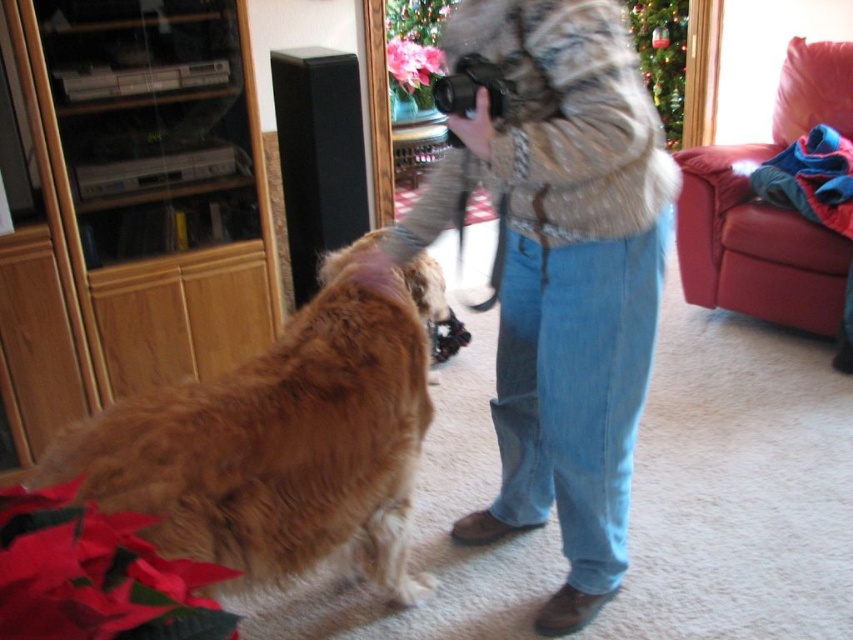
Question: Is golden fur dog at center to the left of pink matte poinsettia at upper center from the viewer's perspective?

Choices:
 (A) no
 (B) yes

Answer: (B)

Question: Can you confirm if fuzzy brown fur coat at center is positioned to the right of pink matte poinsettia at upper center?

Choices:
 (A) no
 (B) yes

Answer: (B)

Question: Which point is farther to the camera?

Choices:
 (A) (636, 99)
 (B) (312, 324)

Answer: (B)

Question: Based on their relative distances, which object is farther from the golden fur dog at center?

Choices:
 (A) pink matte poinsettia at upper center
 (B) fuzzy fur hat at center
 (C) fuzzy brown fur coat at center

Answer: (A)

Question: Which object appears closest to the camera in this image?

Choices:
 (A) fuzzy fur hat at center
 (B) fuzzy brown fur coat at center
 (C) pink matte poinsettia at upper center

Answer: (B)

Question: Does golden fur dog at center have a smaller size compared to pink matte poinsettia at upper center?

Choices:
 (A) yes
 (B) no

Answer: (B)